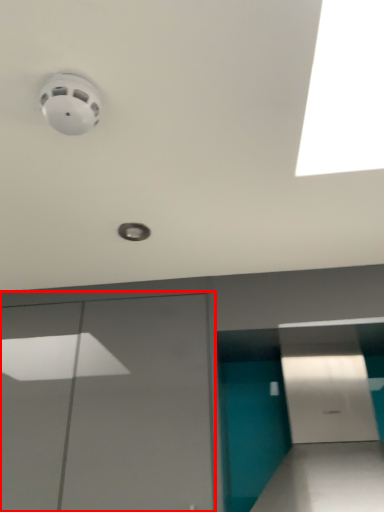
Question: From the image's perspective, where is garage door (annotated by the red box) located relative to parking garage?

Choices:
 (A) below
 (B) above

Answer: (A)